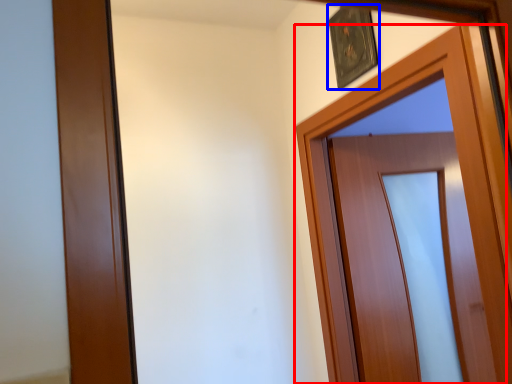
Question: Which object is closer to the camera taking this photo, door (highlighted by a red box) or picture frame (highlighted by a blue box)?

Choices:
 (A) door
 (B) picture frame

Answer: (A)